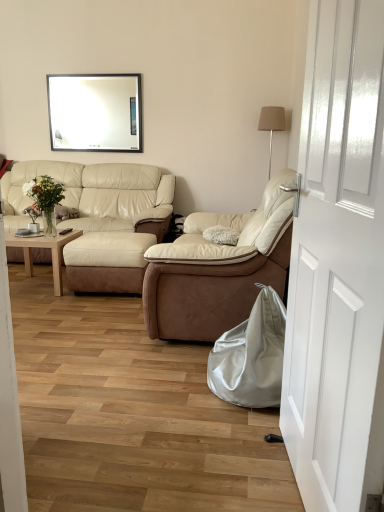
Question: Considering the relative positions of beige leather couch at center, the 2th studio couch in the right-to-left sequence, and beige leather recliner at center, the 1th studio couch from the front, in the image provided, is beige leather couch at center, the 2th studio couch in the right-to-left sequence, to the right of beige leather recliner at center, the 1th studio couch from the front, from the viewer's perspective?

Choices:
 (A) no
 (B) yes

Answer: (A)

Question: Is beige leather couch at center, acting as the first studio couch starting from the back, thinner than beige leather recliner at center, the 1th studio couch in the right-to-left sequence?

Choices:
 (A) yes
 (B) no

Answer: (B)

Question: Can beige leather recliner at center, the 1th studio couch in the right-to-left sequence, be found inside beige leather couch at center, the 2th studio couch in the right-to-left sequence?

Choices:
 (A) no
 (B) yes

Answer: (A)

Question: Can you confirm if beige leather couch at center, the second studio couch in the front-to-back sequence, is smaller than beige leather recliner at center, arranged as the 2th studio couch when viewed from the back?

Choices:
 (A) yes
 (B) no

Answer: (B)

Question: Is beige leather couch at center, the 1th studio couch from the left, bigger than beige leather recliner at center, the 1th studio couch from the front?

Choices:
 (A) yes
 (B) no

Answer: (A)

Question: Considering the positions of beige leather couch at center, the 2th studio couch in the right-to-left sequence, and light wood/finished coffee table at left in the image, is beige leather couch at center, the 2th studio couch in the right-to-left sequence, taller or shorter than light wood/finished coffee table at left?

Choices:
 (A) short
 (B) tall

Answer: (B)

Question: Is point (64, 196) positioned closer to the camera than point (54, 287)?

Choices:
 (A) closer
 (B) farther

Answer: (B)

Question: From the image's perspective, relative to light wood/finished coffee table at left, is beige leather couch at center, the second studio couch in the front-to-back sequence, above or below?

Choices:
 (A) below
 (B) above

Answer: (B)

Question: Is beige leather couch at center, the 1th studio couch from the left, inside or outside of light wood/finished coffee table at left?

Choices:
 (A) inside
 (B) outside

Answer: (B)

Question: Is light wood/finished coffee table at left taller or shorter than beige fabric lampshade at upper right?

Choices:
 (A) tall
 (B) short

Answer: (B)

Question: Is light wood/finished coffee table at left to the left or to the right of beige fabric lampshade at upper right in the image?

Choices:
 (A) left
 (B) right

Answer: (A)

Question: From a real-world perspective, is light wood/finished coffee table at left physically located above or below beige fabric lampshade at upper right?

Choices:
 (A) below
 (B) above

Answer: (A)

Question: Considering their positions, is light wood/finished coffee table at left located in front of or behind beige fabric lampshade at upper right?

Choices:
 (A) front
 (B) behind

Answer: (A)

Question: Considering the positions of white glossy mirror at upper center and satin silver bean bag at lower right in the image, is white glossy mirror at upper center taller or shorter than satin silver bean bag at lower right?

Choices:
 (A) short
 (B) tall

Answer: (B)

Question: From a real-world perspective, is white glossy mirror at upper center positioned above or below satin silver bean bag at lower right?

Choices:
 (A) above
 (B) below

Answer: (A)